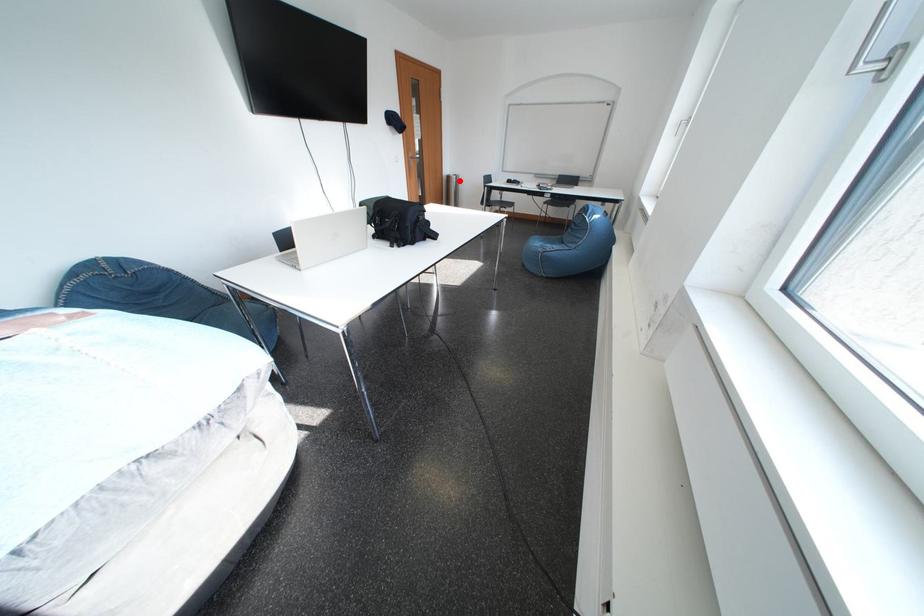
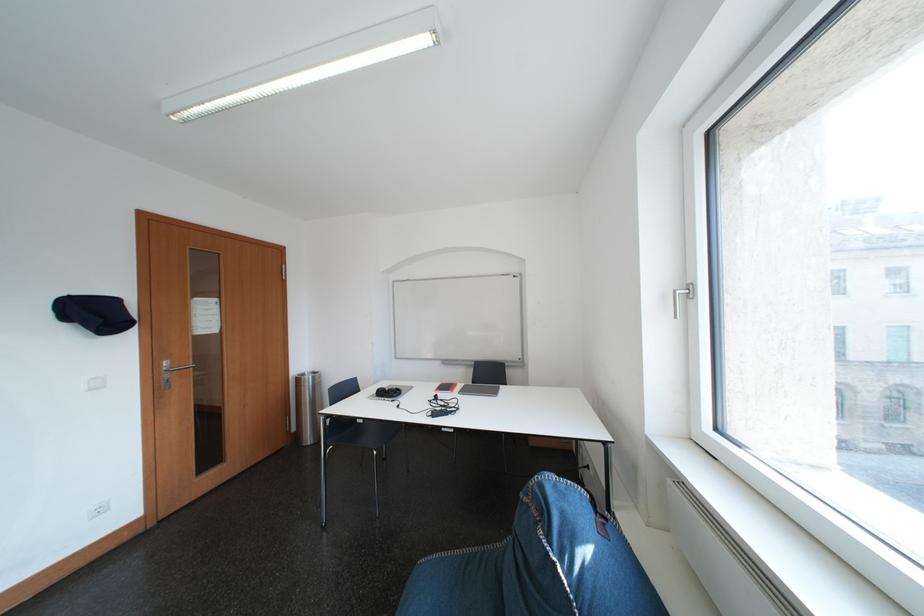
Locate, in the second image, the point that corresponds to the highlighted location in the first image.

(310, 383)